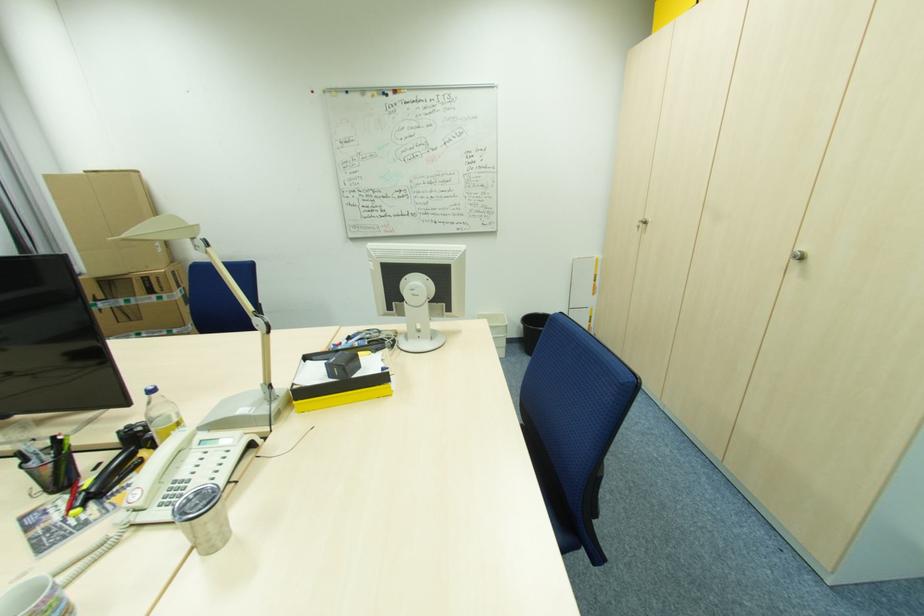
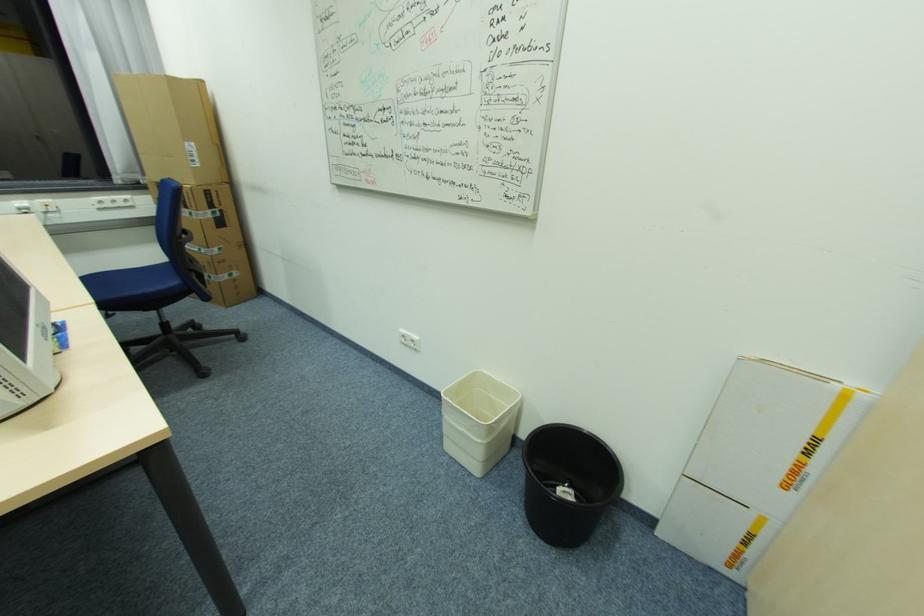
The point at (593, 317) is marked in the first image. Where is the corresponding point in the second image?

(752, 535)